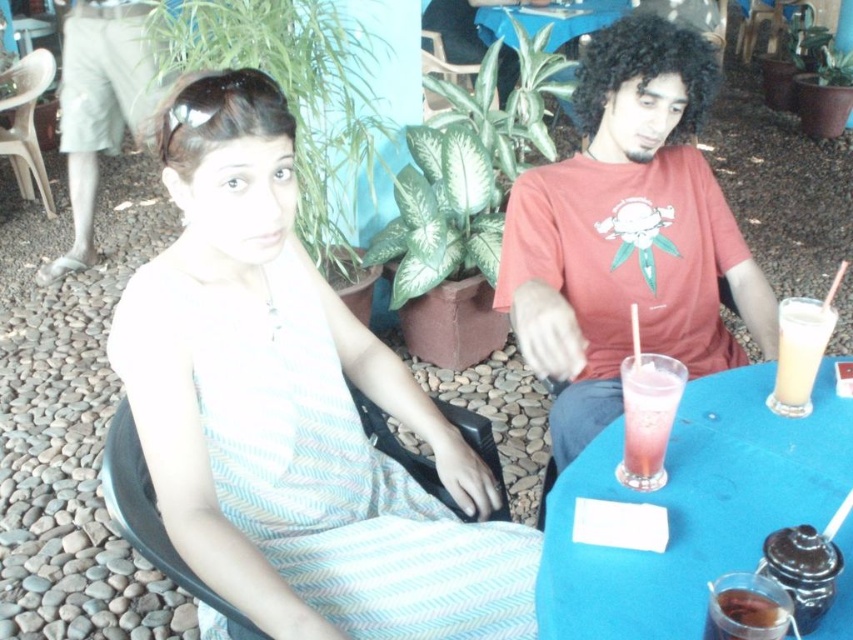
Is point (581, 360) closer to viewer compared to point (129, 16)?

Yes, it is.

Can you confirm if matte red t-shirt at center is positioned to the right of light khaki shorts at left?

Indeed, matte red t-shirt at center is positioned on the right side of light khaki shorts at left.

Identify the location of matte red t-shirt at center. (628, 234).

Find the location of `matte red t-shirt at center`. matte red t-shirt at center is located at coordinates tap(628, 234).

Is the position of light khaki shorts at left less distant than that of pink translucent glass at center?

No, it is not.

Is light khaki shorts at left thinner than pink translucent glass at center?

No.

Is point (125, 70) positioned before point (643, 404)?

No, it is behind (643, 404).

Locate an element on the screen. The width and height of the screenshot is (853, 640). light khaki shorts at left is located at coordinates (97, 106).

Who is lower down, blue plastic table at center or light khaki shorts at left?

Positioned lower is blue plastic table at center.

Who is more forward, (851,426) or (86,22)?

Point (851,426)

Which is in front, point (714, 448) or point (76, 61)?

Point (714, 448) is more forward.

The image size is (853, 640). What are the coordinates of `blue plastic table at center` in the screenshot? It's located at (693, 506).